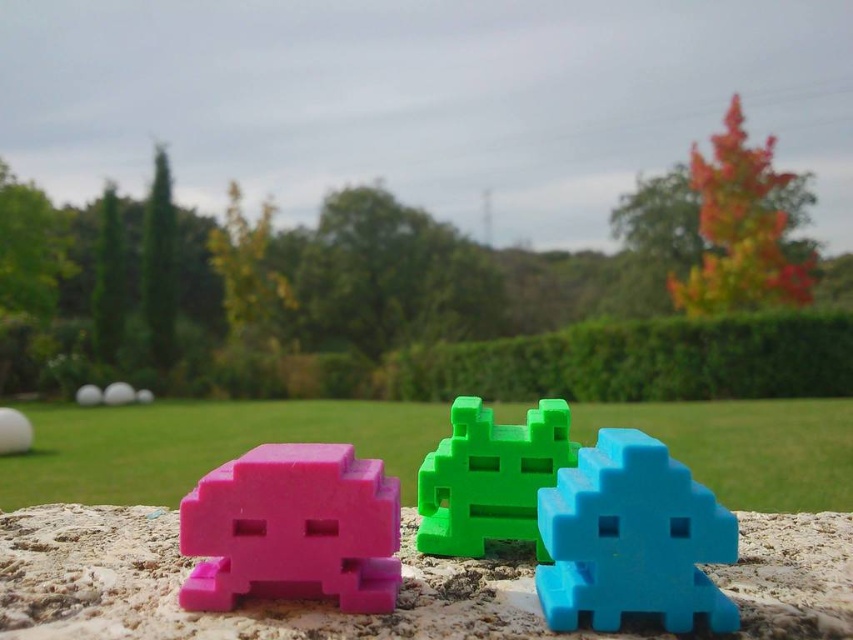
Who is higher up, pink matte toy at center or matte white sphere at center?

pink matte toy at center is higher up.

You are a GUI agent. You are given a task and a screenshot of the screen. Output one action in this format:
    pyautogui.click(x=<x>, y=<y>)
    Task: Click on the pink matte toy at center
    
    Given the screenshot: What is the action you would take?
    pyautogui.click(x=119, y=394)

The image size is (853, 640). What are the coordinates of `pink matte toy at center` in the screenshot? It's located at (119, 394).

Can you confirm if pink matte toy at left is shorter than matte plastic toy at center?

Indeed, pink matte toy at left has a lesser height compared to matte plastic toy at center.

Between pink matte toy at left and matte plastic toy at center, which one appears on the left side from the viewer's perspective?

From the viewer's perspective, pink matte toy at left appears more on the left side.

Between point (334, 528) and point (705, 556), which one is positioned behind?

Point (334, 528)

The image size is (853, 640). I want to click on pink matte toy at left, so click(292, 529).

Who is shorter, pink matte toy at center or white matte golf ball at upper left?

With less height is white matte golf ball at upper left.

Measure the distance from pink matte toy at center to white matte golf ball at upper left.

A distance of 1.46 inches exists between pink matte toy at center and white matte golf ball at upper left.

Describe the element at coordinates (119, 394) in the screenshot. I see `pink matte toy at center` at that location.

At what (x,y) coordinates should I click in order to perform the action: click on pink matte toy at center. Please return your answer as a coordinate pair (x, y). This screenshot has width=853, height=640. Looking at the image, I should click on (119, 394).